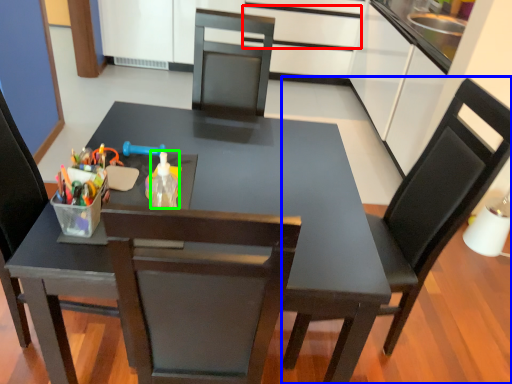
Question: Which object is positioned farthest from drawer (highlighted by a red box)? Select from chair (highlighted by a blue box) and bottle (highlighted by a green box).

Choices:
 (A) chair
 (B) bottle

Answer: (B)